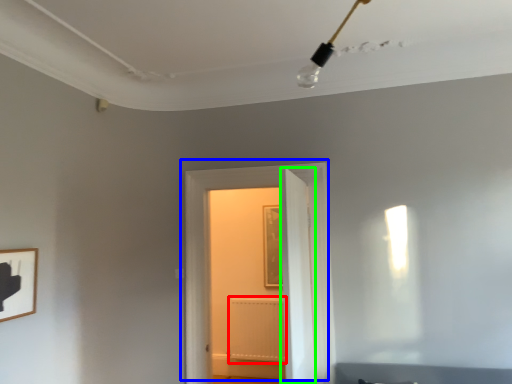
Question: Based on their relative distances, which object is farther from radiator (highlighted by a red box)? Choose from door (highlighted by a blue box) and door (highlighted by a green box).

Choices:
 (A) door
 (B) door

Answer: (B)